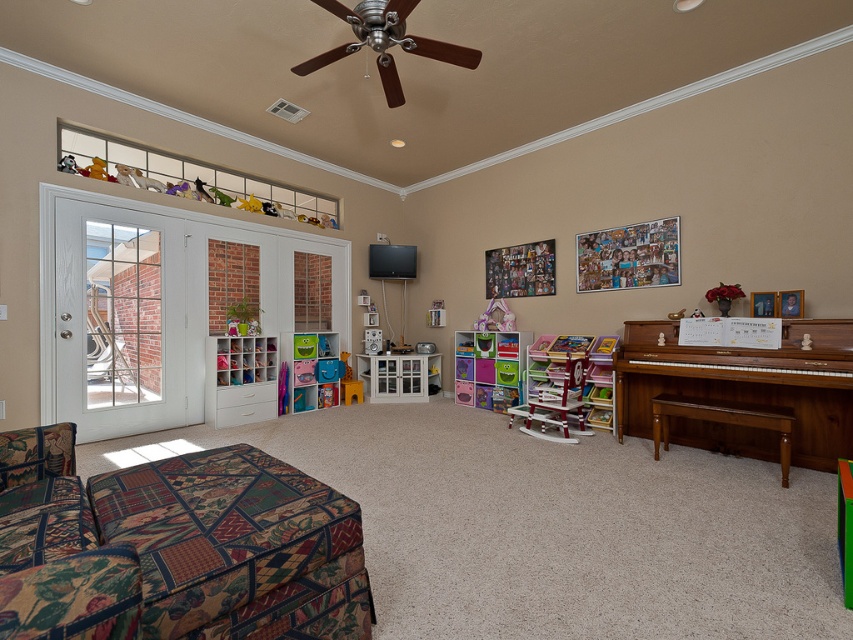
Does mahogany polished piano at right have a lesser width compared to multicolored plastic toy storage at center?

Incorrect, mahogany polished piano at right's width is not less than multicolored plastic toy storage at center's.

Is point (729, 381) positioned after point (506, 369)?

No, it is not.

This screenshot has height=640, width=853. Find the location of `mahogany polished piano at right`. mahogany polished piano at right is located at coordinates (746, 381).

Does patterned fabric couch at lower left come behind white wood glass door at left?

No, it is not.

Can you confirm if patterned fabric couch at lower left is bigger than white wood glass door at left?

No.

Does point (254, 516) come behind point (126, 332)?

No, it is in front of (126, 332).

Find the location of a particular element. This screenshot has width=853, height=640. patterned fabric couch at lower left is located at coordinates coord(183,554).

Does patterned fabric couch at lower left have a lesser height compared to mahogany polished piano at right?

Correct, patterned fabric couch at lower left is not as tall as mahogany polished piano at right.

Based on the photo, which is more to the left, patterned fabric couch at lower left or mahogany polished piano at right?

From the viewer's perspective, patterned fabric couch at lower left appears more on the left side.

The image size is (853, 640). Find the location of `patterned fabric couch at lower left`. patterned fabric couch at lower left is located at coordinates (183, 554).

Find the location of a particular element. The image size is (853, 640). patterned fabric couch at lower left is located at coordinates (183, 554).